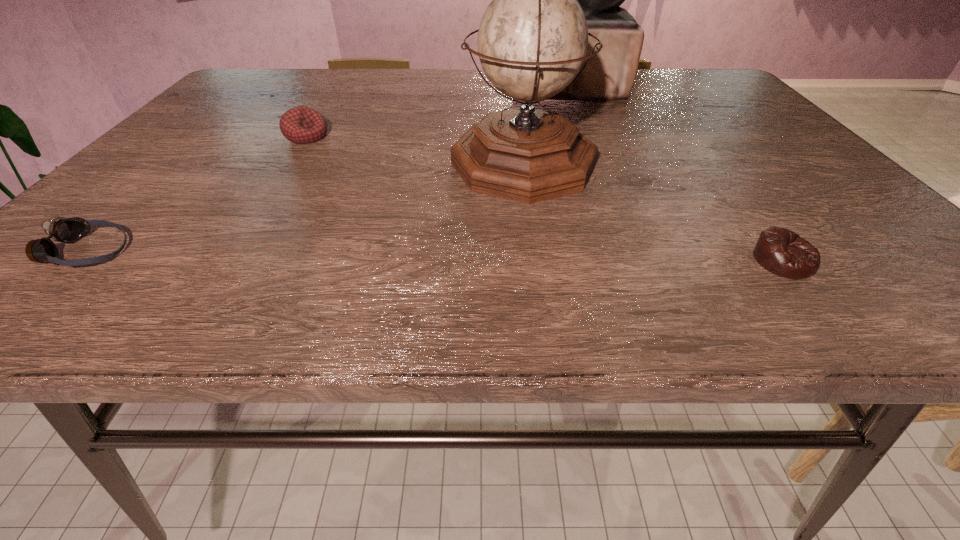
Locate an element on the screen. the farthest object is located at coordinates (609, 75).

Find the location of a particular element. This screenshot has height=540, width=960. the tallest object is located at coordinates (609, 75).

Identify the location of the second tallest object. This screenshot has height=540, width=960. (532, 41).

This screenshot has height=540, width=960. I want to click on the farther beanbag, so click(301, 125).

Identify the location of the second object from left to right. Image resolution: width=960 pixels, height=540 pixels. (301, 125).

Identify the location of goggles. (60, 229).

The height and width of the screenshot is (540, 960). What are the coordinates of `the shorter beanbag` in the screenshot? It's located at (780, 251).

Find the location of a particular element. the nearer beanbag is located at coordinates (780, 251).

The height and width of the screenshot is (540, 960). I want to click on blank area located in a relaxed pose on the farthest object, so click(x=444, y=87).

Find the location of a particular element. This screenshot has width=960, height=540. vacant space located 0.310m in a relaxed pose on the farthest object is located at coordinates (413, 87).